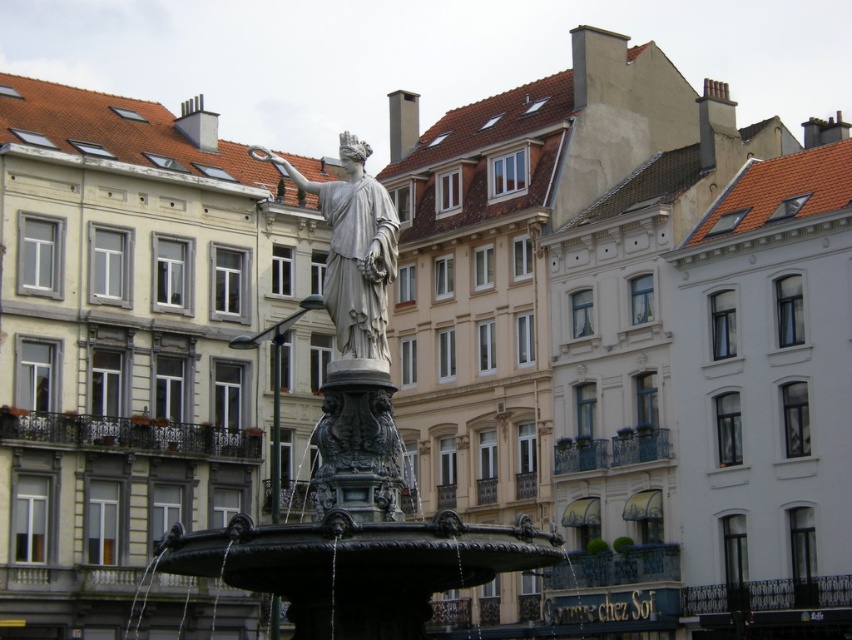
Is bronze fountain at center bigger than white marble statue at center?

Indeed, bronze fountain at center has a larger size compared to white marble statue at center.

How distant is bronze fountain at center from white marble statue at center?

bronze fountain at center is 3.60 meters from white marble statue at center.

Which is behind, point (331, 442) or point (331, 280)?

Positioned behind is point (331, 280).

Identify the location of bronze fountain at center. click(x=355, y=467).